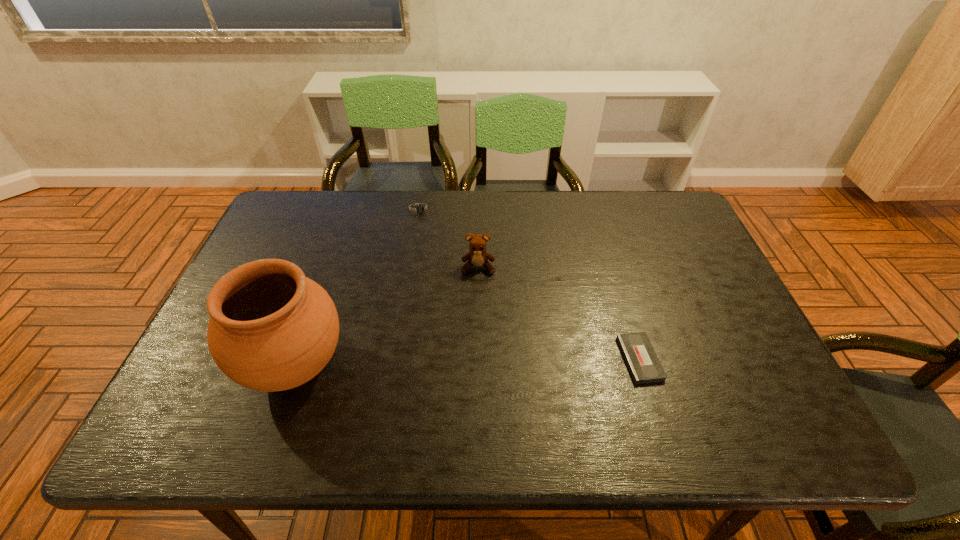
Where is `blank area in the image that satisfies the following two spatial constraints: 1. on the back side of the second object from right to left; 2. on the right side of the leftmost object`? blank area in the image that satisfies the following two spatial constraints: 1. on the back side of the second object from right to left; 2. on the right side of the leftmost object is located at coordinates (329, 267).

Where is `vacant space that satisfies the following two spatial constraints: 1. on the front side of the third object from right to left; 2. on the right side of the shortest object`? This screenshot has width=960, height=540. vacant space that satisfies the following two spatial constraints: 1. on the front side of the third object from right to left; 2. on the right side of the shortest object is located at coordinates (396, 359).